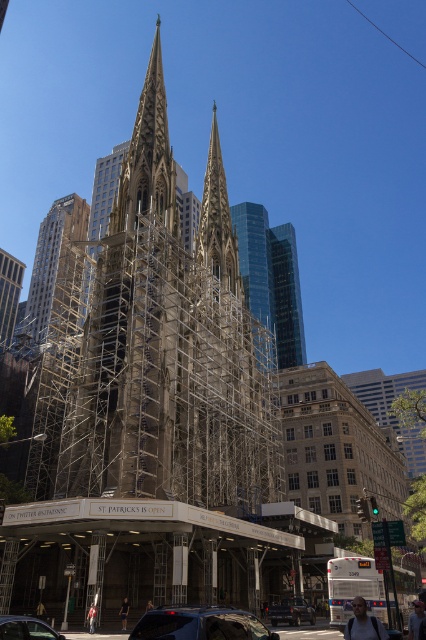
Question: Based on their relative distances, which object is farther from the glassy reflective skyscraper at right?

Choices:
 (A) gold metallic spire at upper left
 (B) metallic silver car at lower center
 (C) matte black car at lower left

Answer: (C)

Question: Is gold metallic spire at upper left smaller than black matte car at lower center?

Choices:
 (A) yes
 (B) no

Answer: (B)

Question: Which point is farther to the camera?

Choices:
 (A) (226, 620)
 (B) (310, 620)
 (C) (49, 628)
 (D) (293, 321)

Answer: (D)

Question: Which of the following is the closest to the observer?

Choices:
 (A) (287, 612)
 (B) (69, 198)

Answer: (A)

Question: Does black matte car at lower center have a smaller size compared to matte black car at lower left?

Choices:
 (A) yes
 (B) no

Answer: (B)

Question: Can you confirm if glassy reflective skyscraper at right is thinner than black matte car at lower center?

Choices:
 (A) yes
 (B) no

Answer: (B)